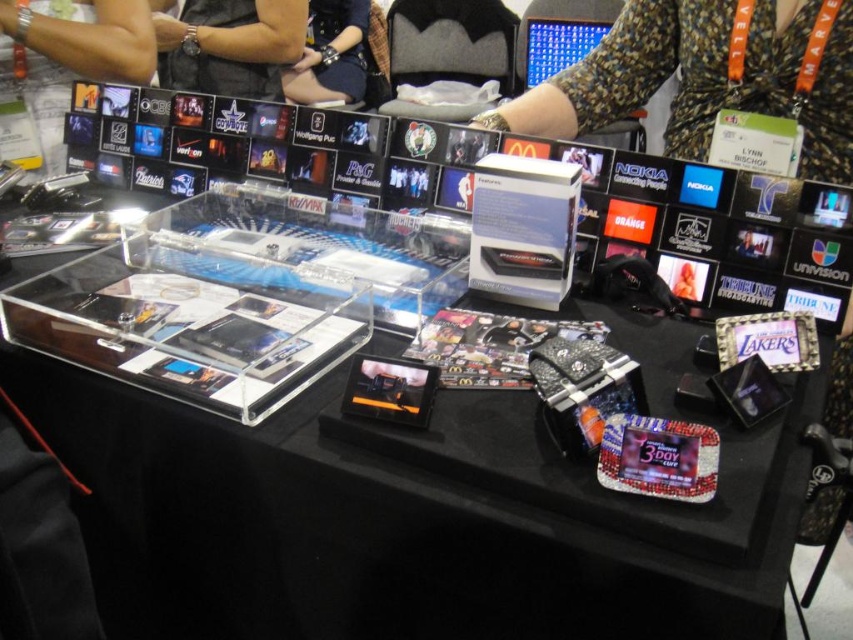
Question: Which object is farther from the camera taking this photo?

Choices:
 (A) transparent acrylic tray at center
 (B) floral-patterned blouse at upper center

Answer: (B)

Question: Which point is farther to the camera?

Choices:
 (A) (337, 17)
 (B) (267, 32)
 (C) (651, 42)
 (D) (381, 532)

Answer: (A)

Question: Is transparent acrylic tray at center thinner than floral-patterned blouse at upper center?

Choices:
 (A) yes
 (B) no

Answer: (B)

Question: Which point is farther to the camera?

Choices:
 (A) matte black arm at upper left
 (B) black leather wristband at center
 (C) floral-patterned blouse at upper center
 (D) matte black watch at upper center

Answer: (B)

Question: Can you confirm if matte black watch at upper center is wider than matte black arm at upper left?

Choices:
 (A) no
 (B) yes

Answer: (B)

Question: Is transparent acrylic tray at center thinner than matte black watch at upper center?

Choices:
 (A) yes
 (B) no

Answer: (B)